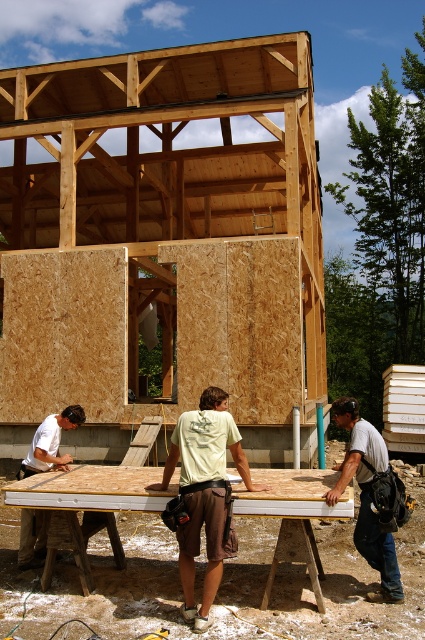
You are a drone operator trying to capture a photo of the construction site. You need to ensure that both the point at coordinates point (204, 580) and point (388, 465) are visible in the frame. Based on their positions, which point should be closer to the camera to avoid obstruction?

Point (204, 580) is in front of point (388, 465), so it will be closer to the camera and less likely to be obstructed.